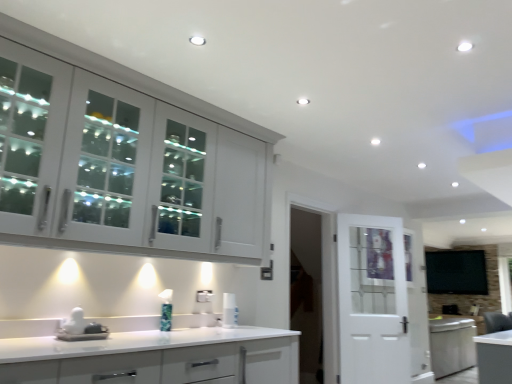
Question: Do you think white glossy spray can at center is within white glossy countertop at lower center, which is the 2th cabinetry in top-to-bottom order, or outside of it?

Choices:
 (A) outside
 (B) inside

Answer: (B)

Question: From the image's perspective, is white glossy spray can at center above or below white glossy countertop at lower center, the first cabinetry from the bottom?

Choices:
 (A) above
 (B) below

Answer: (A)

Question: Which object is the closest to the white glass door at center?

Choices:
 (A) white glossy sink at lower left
 (B) white glossy cabinet at upper left, the 2th cabinetry positioned from the bottom
 (C) white glossy spray can at center
 (D) white glossy countertop at lower center, the first cabinetry from the bottom

Answer: (C)

Question: Considering the real-world distances, which object is closest to the white glossy sink at lower left?

Choices:
 (A) white glossy countertop at lower center, which is the 2th cabinetry in top-to-bottom order
 (B) white glass door at center
 (C) white glossy cabinet at upper left, the first cabinetry from the top
 (D) white glossy spray can at center

Answer: (A)